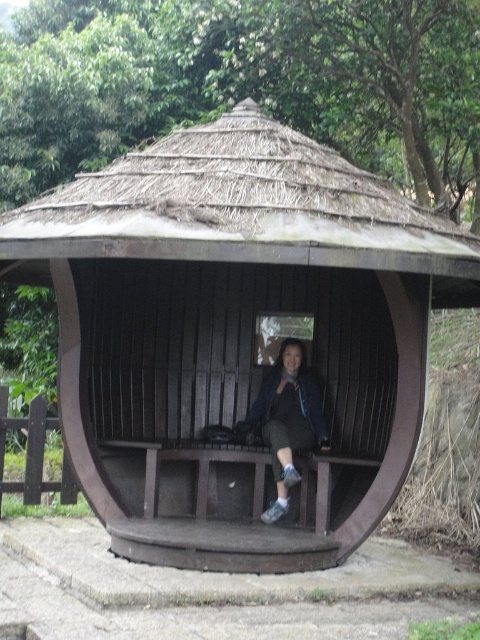
Question: Can you confirm if brown wooden gazebo at center is wider than matte blue jacket at center?

Choices:
 (A) yes
 (B) no

Answer: (A)

Question: Is brown wooden gazebo at center positioned before matte blue jacket at center?

Choices:
 (A) no
 (B) yes

Answer: (B)

Question: Does brown wooden gazebo at center have a lesser width compared to matte blue jacket at center?

Choices:
 (A) no
 (B) yes

Answer: (A)

Question: Among these points, which one is farthest from the camera?

Choices:
 (A) (372, 176)
 (B) (283, 420)

Answer: (B)